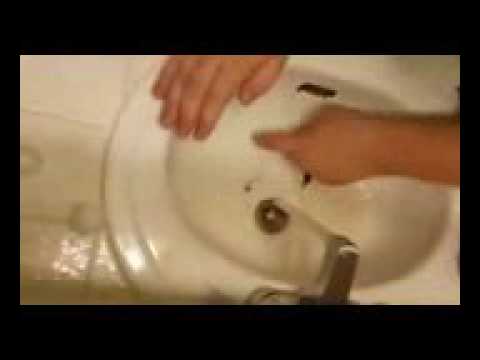
Identify the location of water from faucet. (311, 221).